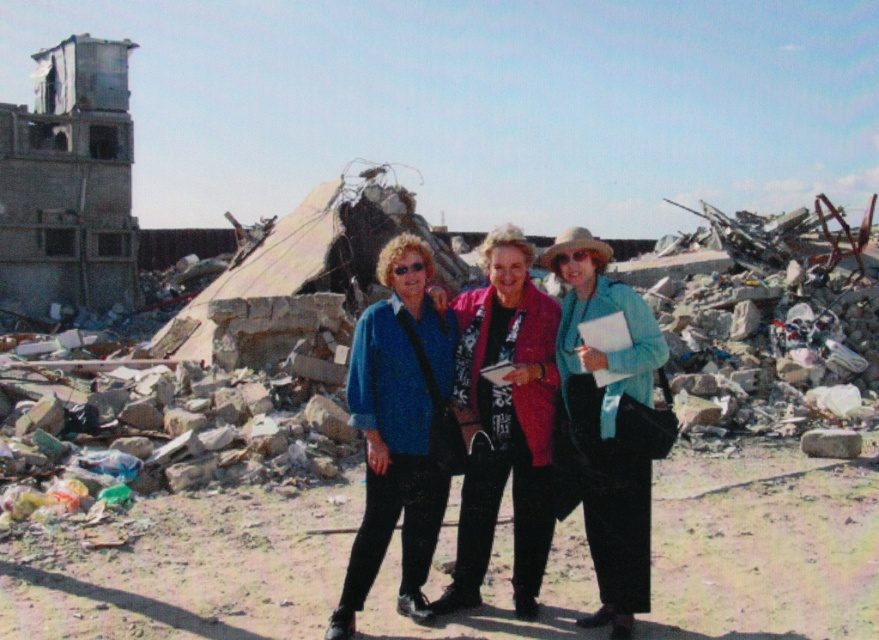
Question: Among these points, which one is nearest to the camera?

Choices:
 (A) (404, 596)
 (B) (535, 490)

Answer: (B)

Question: Which of these objects is positioned farthest from the blue fabric jacket at center?

Choices:
 (A) floral-patterned fabric jacket at center
 (B) matte blue sweater at center

Answer: (A)

Question: Is blue fabric jacket at center closer to the viewer compared to floral-patterned fabric jacket at center?

Choices:
 (A) no
 (B) yes

Answer: (B)

Question: Is the position of blue fabric jacket at center less distant than that of floral-patterned fabric jacket at center?

Choices:
 (A) yes
 (B) no

Answer: (A)

Question: Is matte blue sweater at center bigger than light blue fabric jacket at center?

Choices:
 (A) no
 (B) yes

Answer: (B)

Question: Which of these objects is positioned closest to the blue fabric jacket at center?

Choices:
 (A) matte blue sweater at center
 (B) light blue fabric jacket at center
 (C) floral-patterned fabric jacket at center

Answer: (B)